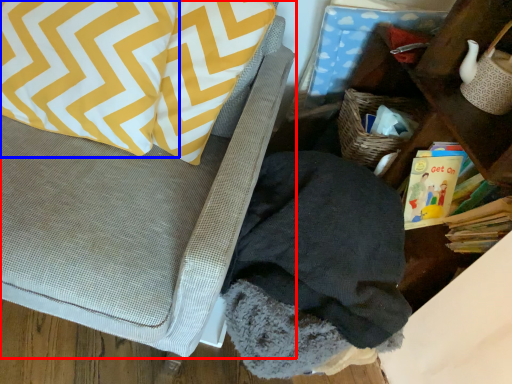
Question: Among these objects, which one is farthest to the camera, furniture (highlighted by a red box) or pillow (highlighted by a blue box)?

Choices:
 (A) furniture
 (B) pillow

Answer: (B)